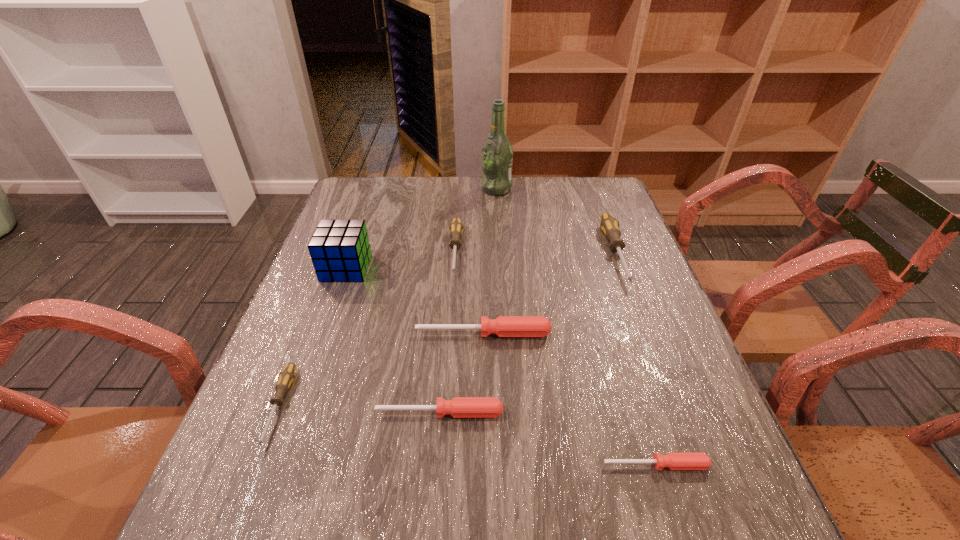
This screenshot has width=960, height=540. I want to click on beer bottle, so click(497, 153).

At what (x,y) coordinates should I click in order to perform the action: click on the farthest object. Please return your answer as a coordinate pair (x, y). The height and width of the screenshot is (540, 960). Looking at the image, I should click on [x=497, y=153].

You are a GUI agent. You are given a task and a screenshot of the screen. Output one action in this format:
    pyautogui.click(x=<x>, y=<y>)
    Task: Click on the second tallest object
    
    Given the screenshot: What is the action you would take?
    pyautogui.click(x=340, y=250)

Identify the location of red cube. (340, 250).

The image size is (960, 540). In order to click on the sixth shortest object in this screenshot , I will do tap(609, 225).

I want to click on the tallest screwdriver, so click(609, 225).

The height and width of the screenshot is (540, 960). Identify the location of the second gray screwdriver from right to left. (456, 228).

Locate an element on the screen. This screenshot has height=540, width=960. the fourth nearest screwdriver is located at coordinates (504, 326).

At what (x,y) coordinates should I click in order to perform the action: click on the biggest red screwdriver. Please return your answer as a coordinate pair (x, y). The image size is (960, 540). Looking at the image, I should click on (504, 326).

Locate an element on the screen. This screenshot has height=540, width=960. the second nearest red screwdriver is located at coordinates (459, 407).